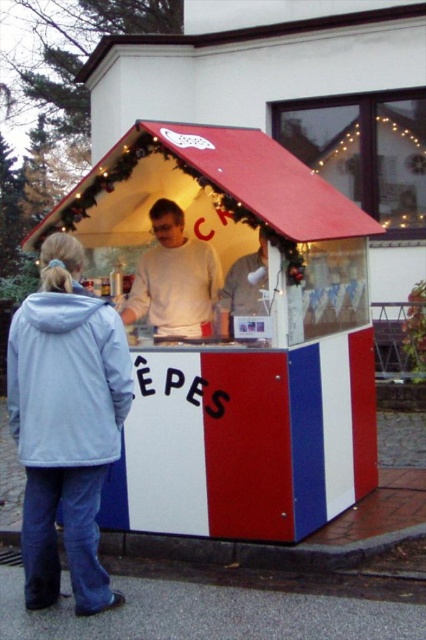
Can you confirm if white plastic stall at center is thinner than light blue fabric jacket at lower left?

Incorrect, white plastic stall at center's width is not less than light blue fabric jacket at lower left's.

Between white plastic stall at center and light blue fabric jacket at lower left, which one is positioned lower?

light blue fabric jacket at lower left is below.

Is point (201, 209) positioned behind point (112, 458)?

Yes, it is behind point (112, 458).

Identify the location of white plastic stall at center. The image size is (426, 640). (241, 340).

Who is more forward, (x=46, y=440) or (x=193, y=257)?

Point (x=46, y=440)

Is light blue fabric jacket at lower left thinner than white matte sweater at center?

Indeed, light blue fabric jacket at lower left has a lesser width compared to white matte sweater at center.

Is point (48, 522) farther from viewer compared to point (183, 244)?

No, (48, 522) is in front of (183, 244).

This screenshot has height=640, width=426. What are the coordinates of `light blue fabric jacket at lower left` in the screenshot? It's located at (66, 422).

Is white plastic stall at center to the left of white matte sweater at center from the viewer's perspective?

Incorrect, white plastic stall at center is not on the left side of white matte sweater at center.

Does white plastic stall at center come in front of white matte sweater at center?

Yes.

You are a GUI agent. You are given a task and a screenshot of the screen. Output one action in this format:
    pyautogui.click(x=<x>, y=<y>)
    Task: Click on the white plastic stall at center
    Image resolution: width=426 pixels, height=640 pixels.
    Given the screenshot: What is the action you would take?
    pyautogui.click(x=241, y=340)